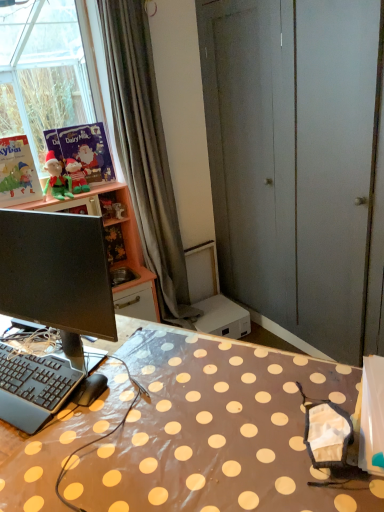
The height and width of the screenshot is (512, 384). I want to click on unoccupied space behind black rubberized computer mouse at lower left, so click(110, 356).